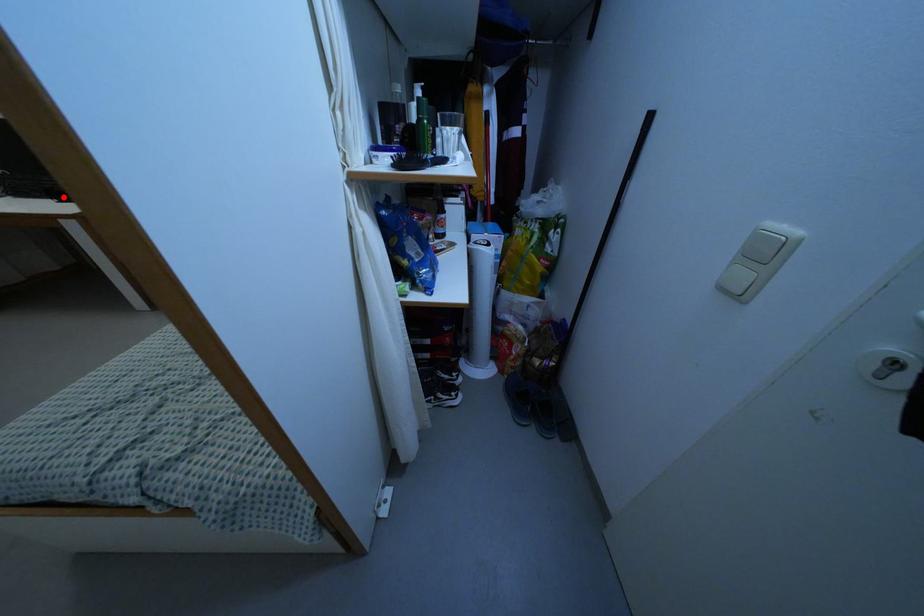
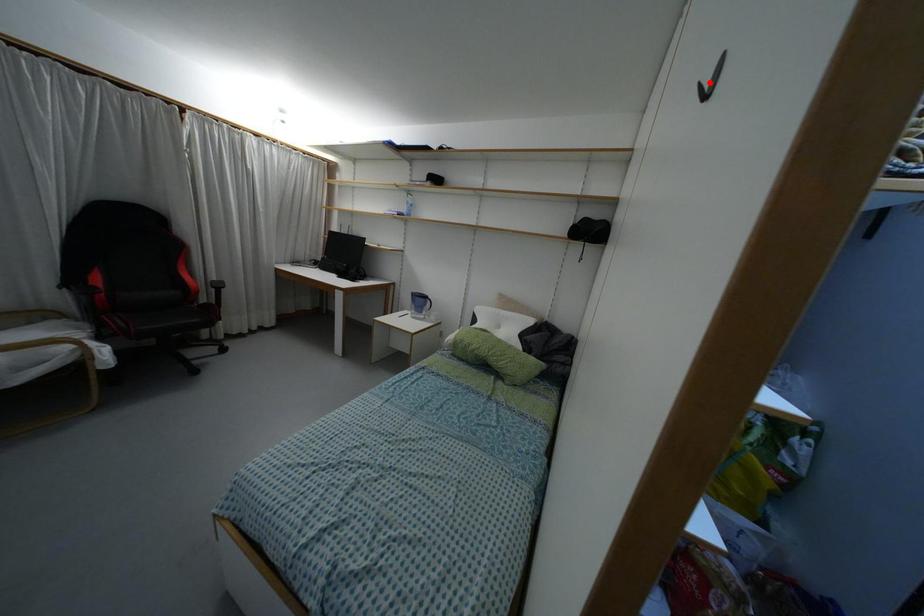
I am providing you with two images of the same scene from different viewpoints. A red point is marked on the first image and another point is marked on the second image. Is the marked point in image1 the same physical position as the marked point in image2?

No